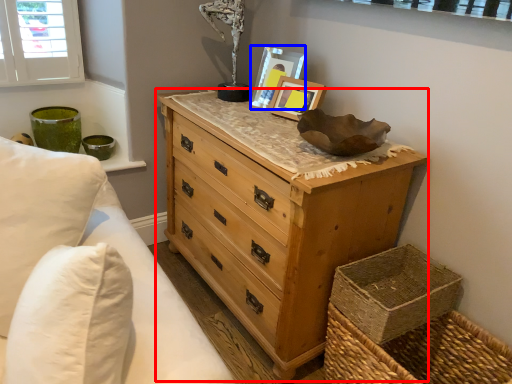
Question: Which of the following is the closest to the observer, chest of drawers (highlighted by a red box) or picture frame (highlighted by a blue box)?

Choices:
 (A) chest of drawers
 (B) picture frame

Answer: (A)